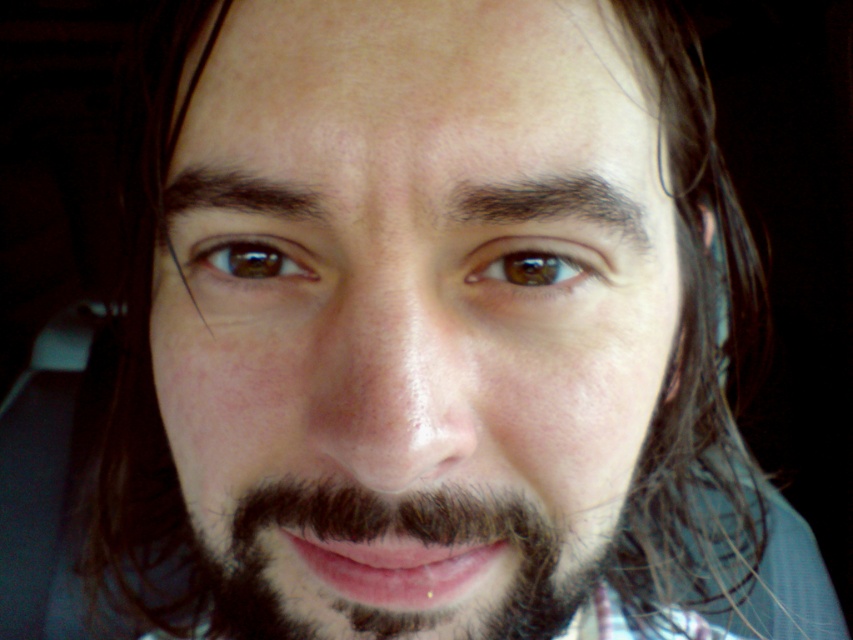
Looking at the person in the image, which facial feature is bigger between the dark brown fuzzy beard at lower center and the brown matte eye at upper center?

The dark brown fuzzy beard at lower center is larger in size compared to the brown matte eye at upper center.

Looking at the person in the image, which facial feature is wider when comparing the dark brown fuzzy beard at lower center and the brown matte eye at upper center?

The dark brown fuzzy beard at lower center is wider than the brown matte eye at upper center.